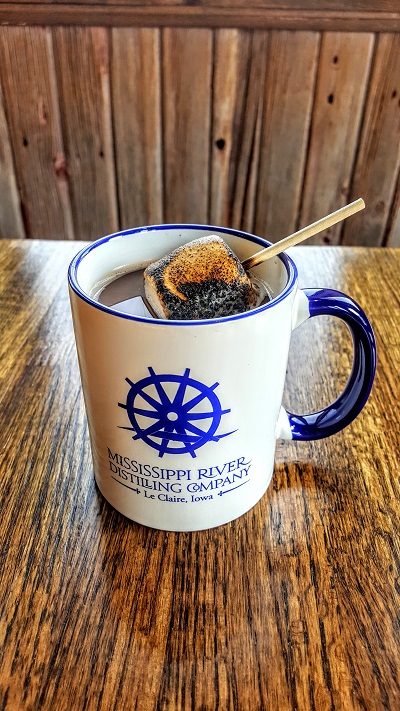
Where is `booth`? This screenshot has width=400, height=711. booth is located at coordinates (207, 97).